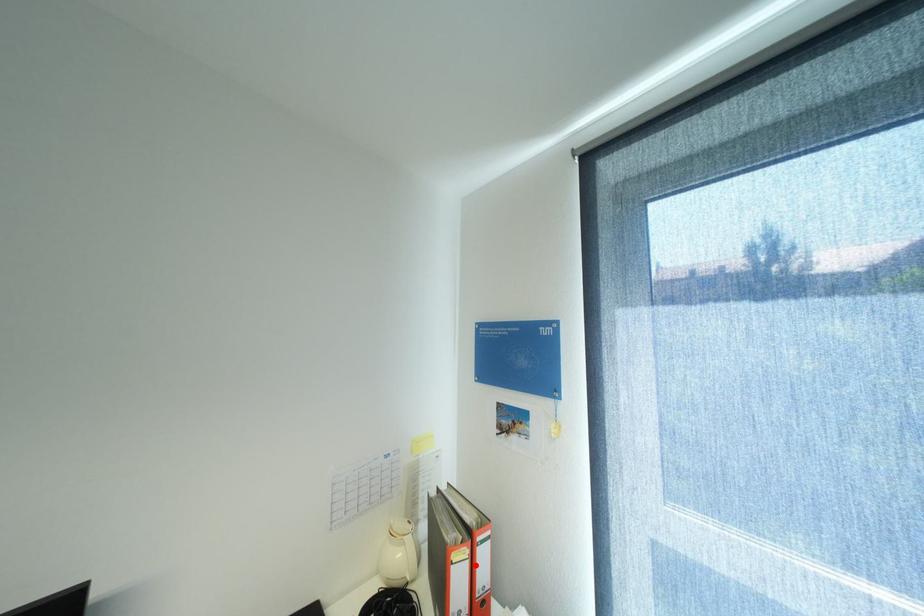
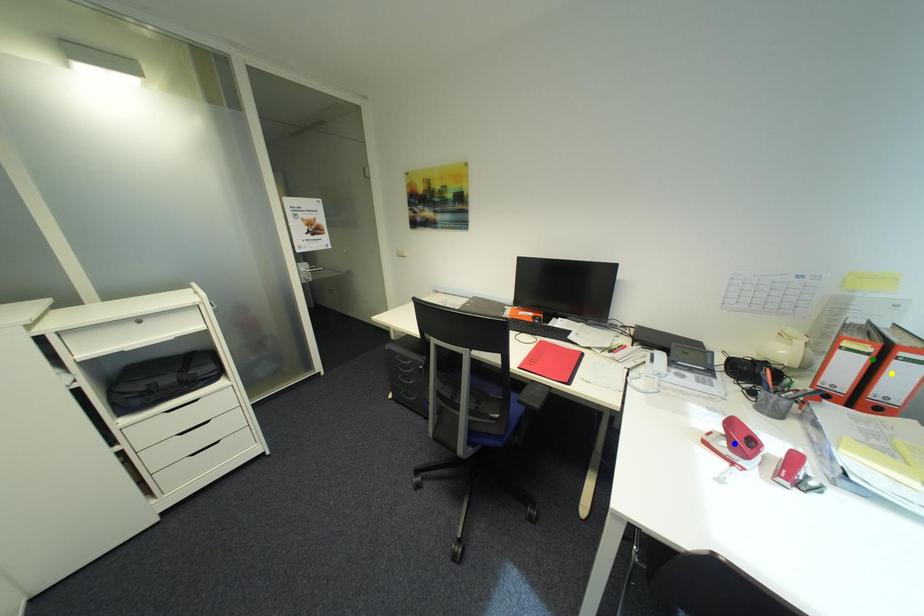
Question: I am providing you with two images of the same scene from different viewpoints. A red point is marked on the first image. You are given multiple points on the second image. Which point in image 2 is actually the same real-world point as the red point in image 1?

Choices:
 (A) green point
 (B) blue point
 (C) yellow point

Answer: (A)